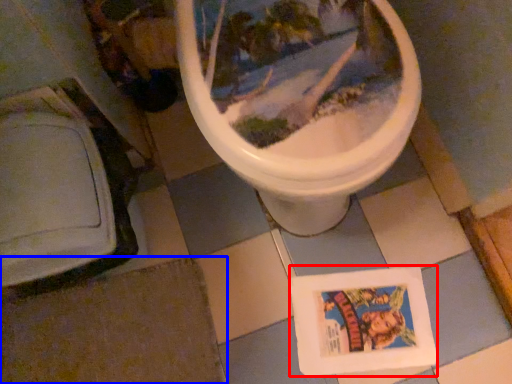
Question: Among these objects, which one is farthest to the camera, comic book (highlighted by a red box) or tile (highlighted by a blue box)?

Choices:
 (A) comic book
 (B) tile

Answer: (A)